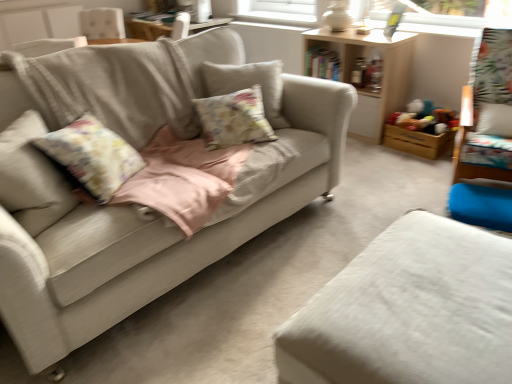
Where is `free space that is to the left of wooden toy box at right`? Image resolution: width=512 pixels, height=384 pixels. free space that is to the left of wooden toy box at right is located at coordinates (374, 153).